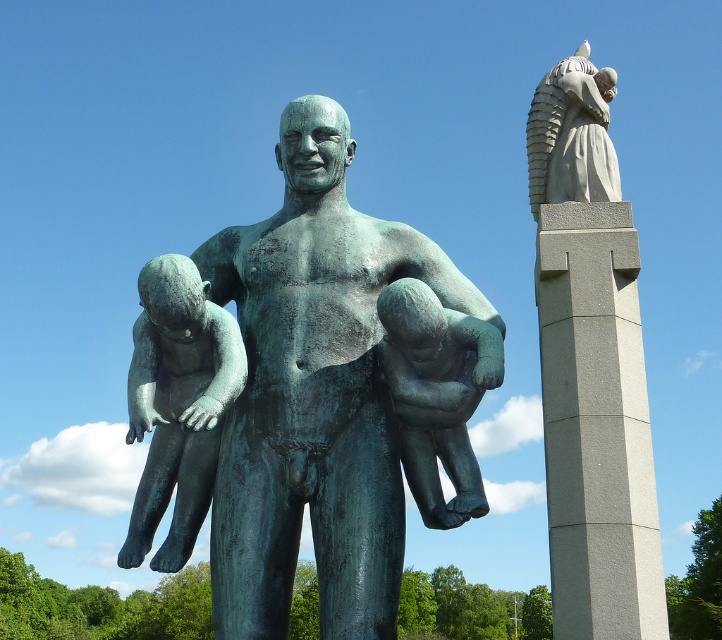
Based on the photo, is gray concrete pillar at right closer to the viewer compared to matte gray statue at upper right?

Yes.

Is point (648, 540) more distant than point (562, 145)?

That is False.

Identify the location of gray concrete pillar at right. The image size is (722, 640). (596, 426).

The width and height of the screenshot is (722, 640). What do you see at coordinates (596, 426) in the screenshot?
I see `gray concrete pillar at right` at bounding box center [596, 426].

Does gray concrete pillar at right come in front of polished bronze child at left?

No, gray concrete pillar at right is behind polished bronze child at left.

What are the coordinates of `gray concrete pillar at right` in the screenshot? It's located at (596, 426).

Can you confirm if gray concrete pillar at right is smaller than bronze baby at center?

No.

Is point (653, 564) behind point (466, 476)?

Yes, point (653, 564) is farther from viewer.

Which is in front, point (656, 518) or point (448, 522)?

Point (448, 522)

Find the location of `gray concrete pillar at right`. gray concrete pillar at right is located at coordinates (596, 426).